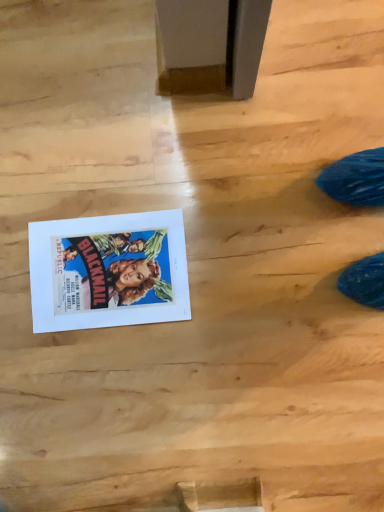
The image size is (384, 512). What do you see at coordinates (221, 495) in the screenshot? I see `wooden plank at lower center` at bounding box center [221, 495].

Locate an element on the screen. Image resolution: width=384 pixels, height=512 pixels. wooden plank at lower center is located at coordinates (221, 495).

You are a GUI agent. You are given a task and a screenshot of the screen. Output one action in this format:
    pyautogui.click(x=<x>, y=<y>)
    Task: Click on the matte paper poster at lower left
    
    Given the screenshot: What is the action you would take?
    pyautogui.click(x=108, y=271)

The image size is (384, 512). Describe the element at coordinates (108, 271) in the screenshot. I see `matte paper poster at lower left` at that location.

Find the location of a particular element. This screenshot has width=384, height=512. wooden plank at lower center is located at coordinates (221, 495).

Can you confirm if wooden plank at lower center is positioned to the left of matte paper poster at lower left?

In fact, wooden plank at lower center is to the right of matte paper poster at lower left.

In the scene shown: Considering the relative positions of wooden plank at lower center and matte paper poster at lower left in the image provided, is wooden plank at lower center behind matte paper poster at lower left?

No, it is not.

Between point (260, 507) and point (121, 218), which one is positioned behind?

The point (121, 218) is farther.

From the image's perspective, between wooden plank at lower center and matte paper poster at lower left, who is located below?

From the image's view, wooden plank at lower center is below.

From a real-world perspective, is wooden plank at lower center on matte paper poster at lower left?

Indeed, from a real-world perspective, wooden plank at lower center stands above matte paper poster at lower left.

Does wooden plank at lower center have a lesser width compared to matte paper poster at lower left?

Correct, the width of wooden plank at lower center is less than that of matte paper poster at lower left.

Which of these two, wooden plank at lower center or matte paper poster at lower left, stands taller?

wooden plank at lower center.

Based on the photo, does wooden plank at lower center have a smaller size compared to matte paper poster at lower left?

Yes, wooden plank at lower center is smaller than matte paper poster at lower left.

Is wooden plank at lower center outside of matte paper poster at lower left?

Yes, wooden plank at lower center is located beyond the bounds of matte paper poster at lower left.

Is wooden plank at lower center beside matte paper poster at lower left?

No, wooden plank at lower center is not beside matte paper poster at lower left.

Is wooden plank at lower center positioned with its back to matte paper poster at lower left?

No.

I want to click on wood below the matte paper poster at lower left (from the image's perspective), so click(x=221, y=495).

In the scene shown: Considering the relative positions of matte paper poster at lower left and wooden plank at lower center in the image provided, is matte paper poster at lower left to the right of wooden plank at lower center from the viewer's perspective?

In fact, matte paper poster at lower left is to the left of wooden plank at lower center.

Between matte paper poster at lower left and wooden plank at lower center, which one is positioned behind?

matte paper poster at lower left is more distant.

Which is closer to the camera, (186, 290) or (210, 509)?

The point (210, 509) is closer.

From the image's perspective, which is below, matte paper poster at lower left or wooden plank at lower center?

wooden plank at lower center appears lower in the image.

From a real-world perspective, is matte paper poster at lower left beneath wooden plank at lower center?

Correct, in the physical world, matte paper poster at lower left is lower than wooden plank at lower center.

Does matte paper poster at lower left have a greater width compared to wooden plank at lower center?

Yes, matte paper poster at lower left is wider than wooden plank at lower center.

Looking at this image, who is shorter, matte paper poster at lower left or wooden plank at lower center?

matte paper poster at lower left is shorter.

Which of these two, matte paper poster at lower left or wooden plank at lower center, is smaller?

wooden plank at lower center is smaller.

Does matte paper poster at lower left contain wooden plank at lower center?

No.

Is matte paper poster at lower left far from wooden plank at lower center?

That's not correct — matte paper poster at lower left is a little close to wooden plank at lower center.

Is matte paper poster at lower left looking in the opposite direction of wooden plank at lower center?

No, matte paper poster at lower left is not facing away from wooden plank at lower center.

How different are the orientations of matte paper poster at lower left and wooden plank at lower center in degrees?

The facing directions of matte paper poster at lower left and wooden plank at lower center are 91.3 degrees apart.

The width and height of the screenshot is (384, 512). I want to click on wood to the right of matte paper poster at lower left, so [x=221, y=495].

Locate an element on the screen. The width and height of the screenshot is (384, 512). comic book above the wooden plank at lower center (from the image's perspective) is located at coordinates (108, 271).

Locate an element on the screen. This screenshot has height=512, width=384. wood in front of the matte paper poster at lower left is located at coordinates (221, 495).